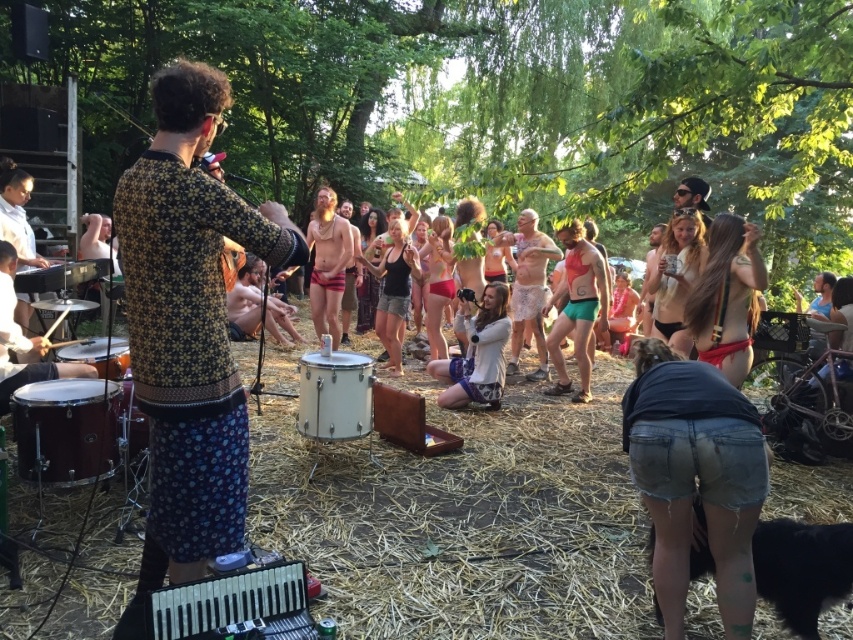
Question: Estimate the real-world distances between objects in this image. Which object is closer to the floral-patterned fabric at center?

Choices:
 (A) metallic drum at left
 (B) wooden drum at lower left
 (C) wooden drum at center

Answer: (C)

Question: Which object is farther from the camera taking this photo?

Choices:
 (A) floral-patterned fabric at center
 (B) light gray sweater at center

Answer: (B)

Question: Does metallic drum at left appear over wooden drum at center?

Choices:
 (A) no
 (B) yes

Answer: (B)

Question: Is mahogany wood drum at lower left bigger than matte red underwear at center?

Choices:
 (A) no
 (B) yes

Answer: (A)

Question: Is light gray sweater at center closer to the viewer compared to wooden drum at center?

Choices:
 (A) no
 (B) yes

Answer: (A)

Question: Based on their relative distances, which object is nearer to the white metallic drum at center?

Choices:
 (A) orange fabric shorts at center
 (B) matte red underwear at center
 (C) wooden drum at lower left
 (D) metallic drum at left

Answer: (C)